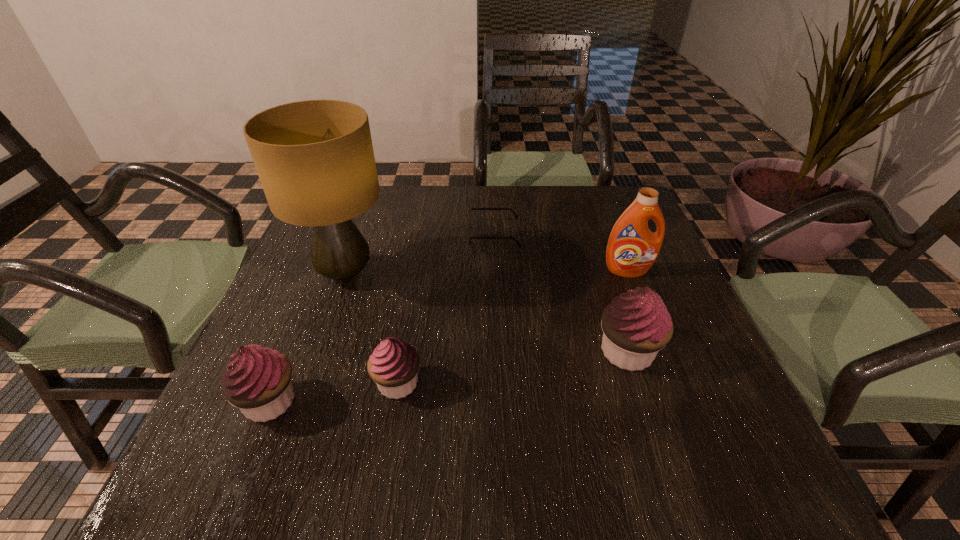
Locate an element on the screen. The image size is (960, 540). the closest cupcake relative to the second cupcake from left to right is located at coordinates (257, 380).

You are a GUI agent. You are given a task and a screenshot of the screen. Output one action in this format:
    pyautogui.click(x=<x>, y=<y>)
    Task: Click on the blank area in the image that satisfies the following two spatial constraints: 1. on the back side of the second cupcake from right to left; 2. on the right side of the rightmost cupcake
    This screenshot has height=540, width=960.
    Given the screenshot: What is the action you would take?
    pyautogui.click(x=403, y=352)

What are the coordinates of `vacant space that satisfies the following two spatial constraints: 1. on the front side of the lampshade; 2. on the right side of the rightmost cupcake` in the screenshot? It's located at (318, 352).

The width and height of the screenshot is (960, 540). Identify the location of vacant space that satisfies the following two spatial constraints: 1. on the back side of the rightmost cupcake; 2. on the right side of the second tallest cupcake. (290, 352).

Where is `free space that satisfies the following two spatial constraints: 1. at the hinge ends of the rightmost cupcake; 2. on the left side of the shortest object`? The image size is (960, 540). free space that satisfies the following two spatial constraints: 1. at the hinge ends of the rightmost cupcake; 2. on the left side of the shortest object is located at coordinates [497, 352].

Locate an element on the screen. free point that satisfies the following two spatial constraints: 1. at the hinge ends of the rightmost cupcake; 2. on the right side of the shortest object is located at coordinates (497, 352).